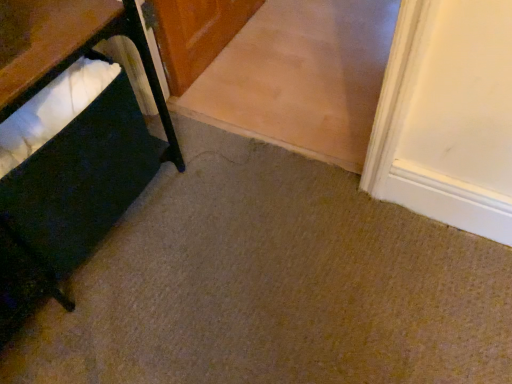
In order to click on black fabric cushion at lower left in this screenshot , I will do `click(67, 144)`.

The width and height of the screenshot is (512, 384). What do you see at coordinates (67, 144) in the screenshot?
I see `black fabric cushion at lower left` at bounding box center [67, 144].

You are a GUI agent. You are given a task and a screenshot of the screen. Output one action in this format:
    pyautogui.click(x=<x>, y=<y>)
    Task: Click on the black fabric cushion at lower left
    The width and height of the screenshot is (512, 384).
    Given the screenshot: What is the action you would take?
    pyautogui.click(x=67, y=144)